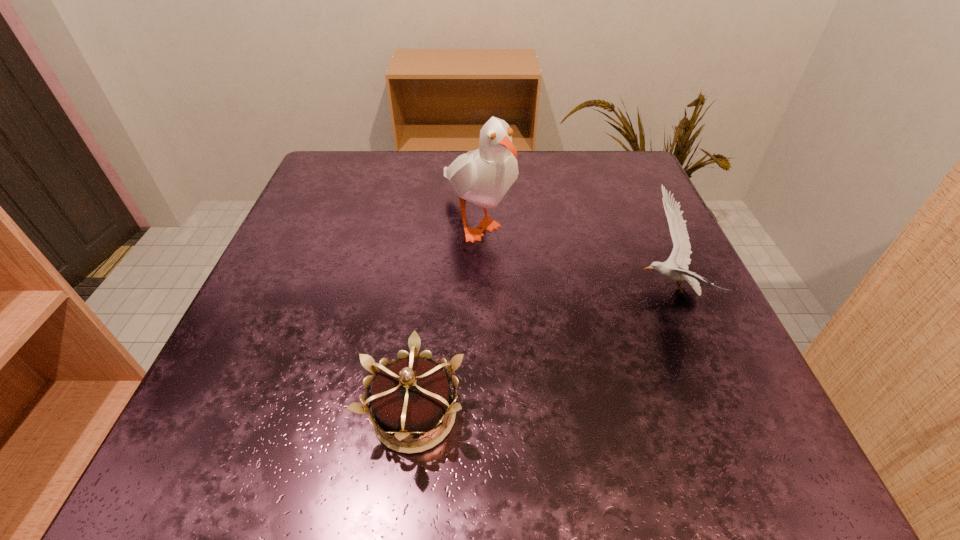
Where is `vacant space that's between the shortest object and the left gull`? This screenshot has width=960, height=540. vacant space that's between the shortest object and the left gull is located at coordinates (445, 318).

Locate an element on the screen. The height and width of the screenshot is (540, 960). free space between the left gull and the rightmost object is located at coordinates (572, 256).

Identify the location of unoccupied position between the tallest object and the nearest object. This screenshot has height=540, width=960. (445, 318).

Locate an element on the screen. The height and width of the screenshot is (540, 960). unoccupied area between the second shortest object and the left gull is located at coordinates (572, 256).

Identify the location of blank region between the crown and the tallest object. This screenshot has width=960, height=540. (445, 318).

This screenshot has height=540, width=960. Find the location of `free area in between the rightmost object and the taller gull`. free area in between the rightmost object and the taller gull is located at coordinates (572, 256).

Find the location of a particular element. vacant space that's between the right gull and the tallest object is located at coordinates (572, 256).

Locate an element on the screen. vacant region between the shortest object and the left gull is located at coordinates (445, 318).

Find the location of a particular element. This screenshot has height=540, width=960. vacant point located between the second shortest object and the crown is located at coordinates (541, 353).

The image size is (960, 540). Find the location of `object that stands as the closest to the second tallest object`. object that stands as the closest to the second tallest object is located at coordinates (483, 176).